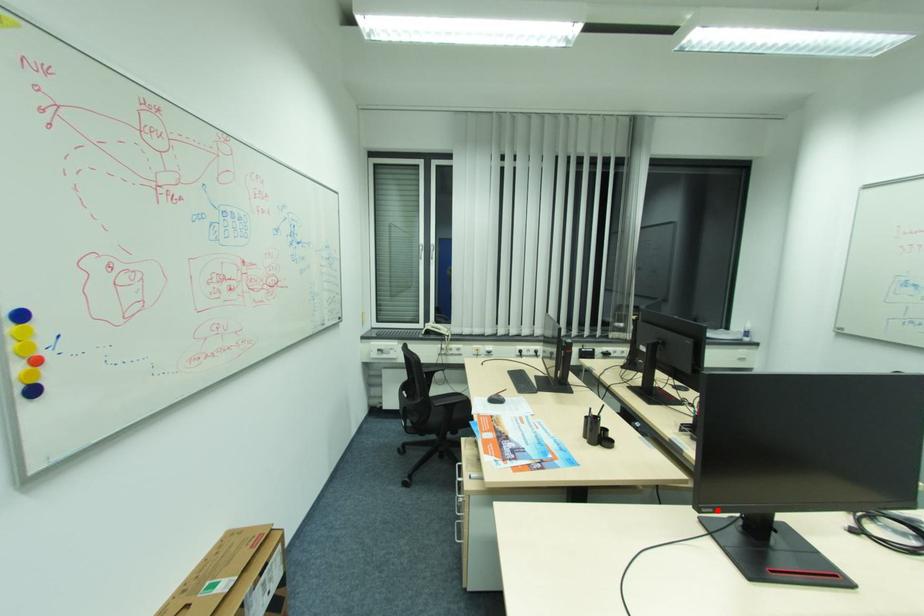
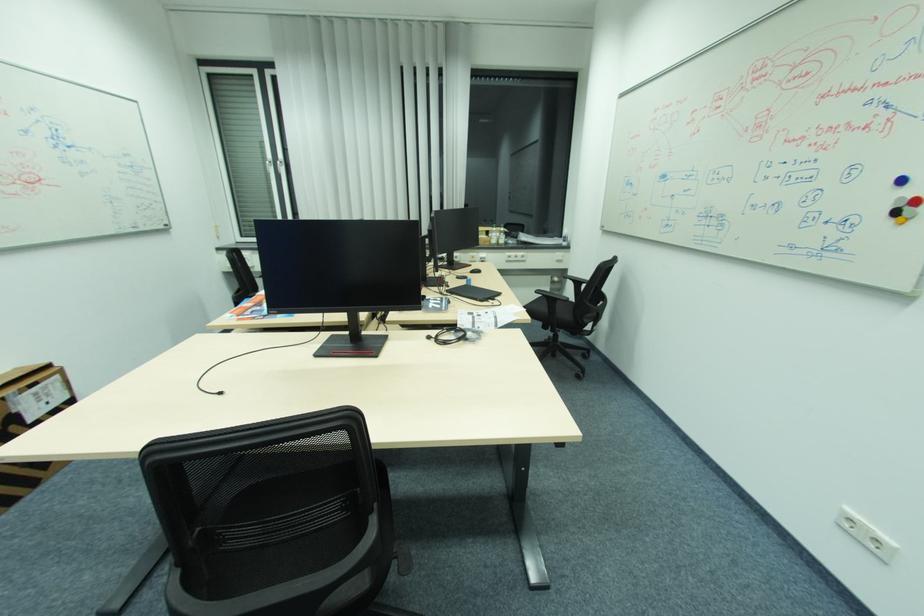
Find the pixel in the second image that matches the highlighted location in the first image.

(282, 312)